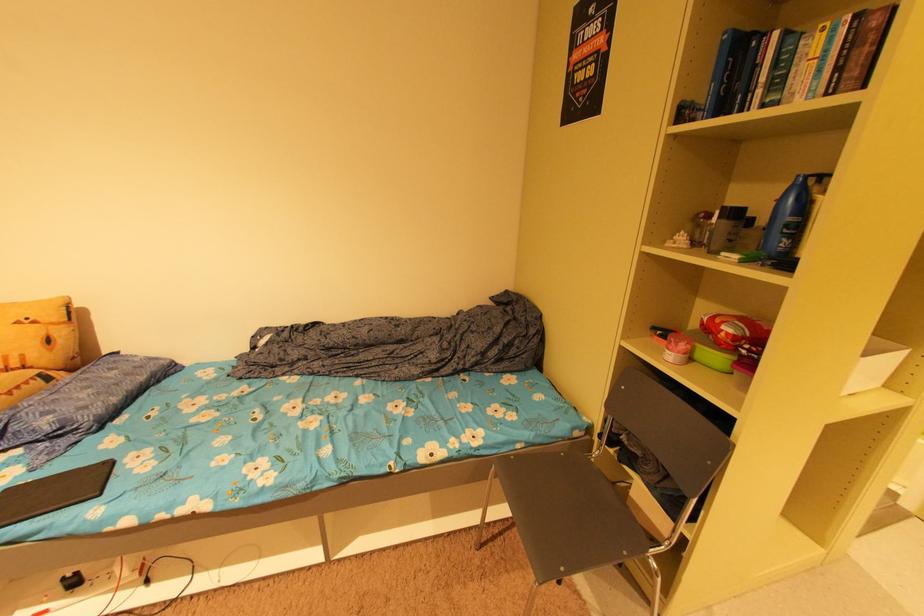
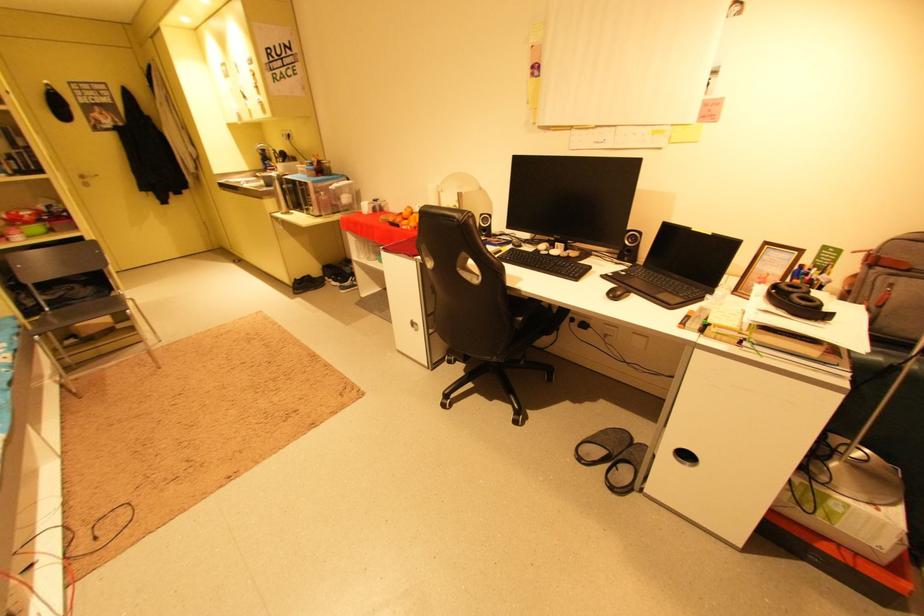
Find the pixel in the second image that matches (723,359) in the first image.

(43, 229)